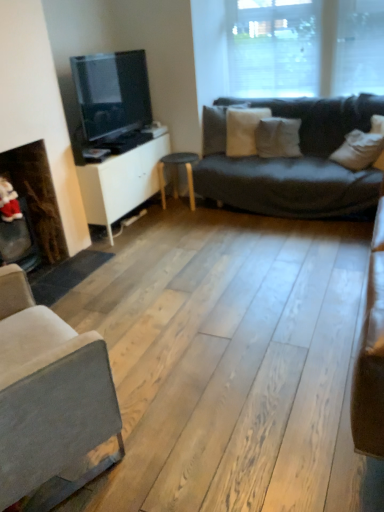
From the picture: Measure the distance between point [236,114] and camera.

Point [236,114] is 12.80 feet away from camera.

Based on the photo, in order to face dark brown wood fireplace at left, should I rotate leftwards or rightwards?

Rotate left and turn 20.038 degrees.

Measure the distance between dark brown wood fireplace at left and camera.

The depth of dark brown wood fireplace at left is 9.13 feet.

Locate an element on the screen. The height and width of the screenshot is (512, 384). matte black stool at center is located at coordinates (177, 174).

Locate an element on the screen. This screenshot has width=384, height=512. white soft pillow at center, which is the 3th pillow in right-to-left order is located at coordinates (243, 129).

Is matte black tv at left facing towards matte black stool at center?

No, matte black tv at left is not facing towards matte black stool at center.

Considering the relative sizes of matte black tv at left and matte black stool at center in the image provided, is matte black tv at left taller than matte black stool at center?

Yes.

Can you confirm if matte black tv at left is positioned to the right of matte black stool at center?

In fact, matte black tv at left is to the left of matte black stool at center.

Consider the image. Which point is more forward, (84, 93) or (163, 179)?

The point (84, 93) is closer to the camera.

Can you tell me how much white matte cabinet at center and white soft pillow at center, which is the 3th pillow in right-to-left order, differ in facing direction?

The angular difference between white matte cabinet at center and white soft pillow at center, which is the 3th pillow in right-to-left order, is 52.5 degrees.

Can you confirm if white matte cabinet at center is positioned to the left of white soft pillow at center, which appears as the first pillow when viewed from the left?

Yes, white matte cabinet at center is to the left of white soft pillow at center, which appears as the first pillow when viewed from the left.

Would you say white soft pillow at center, which is the 3th pillow in right-to-left order, is part of white matte cabinet at center's contents?

Actually, white soft pillow at center, which is the 3th pillow in right-to-left order, is outside white matte cabinet at center.

From a real-world perspective, is transparent glass window at upper center located beneath matte black stool at center?

No.

Considering the relative positions of transparent glass window at upper center and matte black stool at center in the image provided, is transparent glass window at upper center to the left of matte black stool at center from the viewer's perspective?

In fact, transparent glass window at upper center is to the right of matte black stool at center.

Locate an element on the screen. This screenshot has width=384, height=512. table located on the left of transparent glass window at upper center is located at coordinates [177, 174].

Considering the relative sizes of matte black stool at center and white soft pillow at upper right, the first pillow viewed from the right, in the image provided, is matte black stool at center taller than white soft pillow at upper right, the first pillow viewed from the right,?

Correct, matte black stool at center is much taller as white soft pillow at upper right, the first pillow viewed from the right.

Based on their sizes in the image, would you say matte black stool at center is bigger or smaller than white soft pillow at upper right, acting as the 3th pillow starting from the left?

Considering their sizes, matte black stool at center takes up more space than white soft pillow at upper right, acting as the 3th pillow starting from the left.

Which object is wider, matte black stool at center or white soft pillow at upper right, acting as the 3th pillow starting from the left?

matte black stool at center is wider.

What's the angular difference between matte black stool at center and white soft pillow at upper right, the first pillow viewed from the right,'s facing directions?

matte black stool at center and white soft pillow at upper right, the first pillow viewed from the right, are facing 45.9 degrees away from each other.

Which of these two, matte black stool at center or matte black tv at left, is bigger?

Bigger between the two is matte black tv at left.

What's the angular difference between matte black stool at center and matte black tv at left's facing directions?

They differ by 88.3 degrees in their facing directions.

Which object is further away from the camera taking this photo, matte black stool at center or matte black tv at left?

Positioned behind is matte black stool at center.

Looking at this image, from a real-world perspective, who is located lower, matte black stool at center or matte black tv at left?

matte black stool at center.

Looking at the image, does light gray fabric couch at lower left seem bigger or smaller compared to white soft pillow at center, which appears as the first pillow when viewed from the left?

light gray fabric couch at lower left is bigger than white soft pillow at center, which appears as the first pillow when viewed from the left.

Does light gray fabric couch at lower left turn towards white soft pillow at center, which is the 3th pillow in right-to-left order?

Yes, light gray fabric couch at lower left is aimed at white soft pillow at center, which is the 3th pillow in right-to-left order.

This screenshot has height=512, width=384. I want to click on the 3rd pillow above the light gray fabric couch at lower left (from the image's perspective), so click(x=243, y=129).

Does light gray fabric couch at lower left touch white soft pillow at center, which appears as the first pillow when viewed from the left?

No.

How distant is dark brown wood fireplace at left from matte black tv at left?

The distance of dark brown wood fireplace at left from matte black tv at left is 35.30 inches.

At what (x,y) coordinates should I click in order to perform the action: click on television lying behind the dark brown wood fireplace at left. Please return your answer as a coordinate pair (x, y). Image resolution: width=384 pixels, height=512 pixels. Looking at the image, I should click on (112, 93).

Could you tell me if dark brown wood fireplace at left is facing matte black tv at left?

No, dark brown wood fireplace at left does not turn towards matte black tv at left.

Find the location of a particular element. Image resolution: width=384 pixels, height=512 pixels. table on the right of the matte black tv at left is located at coordinates (177, 174).

Where is `cabinetry on the left of white soft pillow at center, which appears as the first pillow when viewed from the left`? cabinetry on the left of white soft pillow at center, which appears as the first pillow when viewed from the left is located at coordinates (121, 182).

Looking at the image, which one is located closer to white matte cabinet at center, dark brown wood fireplace at left or white soft pillow at upper right, the first pillow viewed from the right?

The object closer to white matte cabinet at center is dark brown wood fireplace at left.

Looking at the image, which one is located closer to light gray fabric couch at lower left, white matte cabinet at center or white soft pillow at upper right, acting as the 3th pillow starting from the left?

white matte cabinet at center is positioned closer to the anchor light gray fabric couch at lower left.

Which object lies nearer to the anchor point white matte cabinet at center, transparent glass window at upper center or matte black stool at center?

matte black stool at center lies closer to white matte cabinet at center than the other object.

Which object lies nearer to the anchor point transparent glass window at upper center, matte black stool at center or white soft pillow at center, the 2th pillow from the right?

white soft pillow at center, the 2th pillow from the right, is closer to transparent glass window at upper center.

Estimate the real-world distances between objects in this image. Which object is closer to light gray fabric couch at lower left, matte black stool at center or dark brown wood fireplace at left?

The object closer to light gray fabric couch at lower left is dark brown wood fireplace at left.

Which object lies further to the anchor point white soft pillow at center, the 2th pillow in the left-to-right sequence, white soft pillow at center, which appears as the first pillow when viewed from the left, or dark brown wood fireplace at left?

Among the two, dark brown wood fireplace at left is located further to white soft pillow at center, the 2th pillow in the left-to-right sequence.

Considering their positions, is matte black stool at center positioned further to light gray fabric couch at lower left than matte black tv at left?

matte black stool at center lies further to light gray fabric couch at lower left than the other object.

Estimate the real-world distances between objects in this image. Which object is closer to white soft pillow at center, the 2th pillow from the right, transparent glass window at upper center or dark brown wood fireplace at left?

transparent glass window at upper center is positioned closer to the anchor white soft pillow at center, the 2th pillow from the right.

What are the coordinates of `television located between dark brown wood fireplace at left and white soft pillow at center, which is the 3th pillow in right-to-left order, in the left-right direction` in the screenshot? It's located at (112, 93).

Find the location of a particular element. cabinetry between light gray fabric couch at lower left and white soft pillow at center, which is the 3th pillow in right-to-left order, along the z-axis is located at coordinates (121, 182).

At what (x,y) coordinates should I click in order to perform the action: click on pillow between light gray fabric couch at lower left and transparent glass window at upper center in the front-back direction. Please return your answer as a coordinate pair (x, y). The image size is (384, 512). Looking at the image, I should click on (359, 150).

Locate an element on the screen. television located between white matte cabinet at center and white soft pillow at center, the 2th pillow from the right, in the left-right direction is located at coordinates (112, 93).